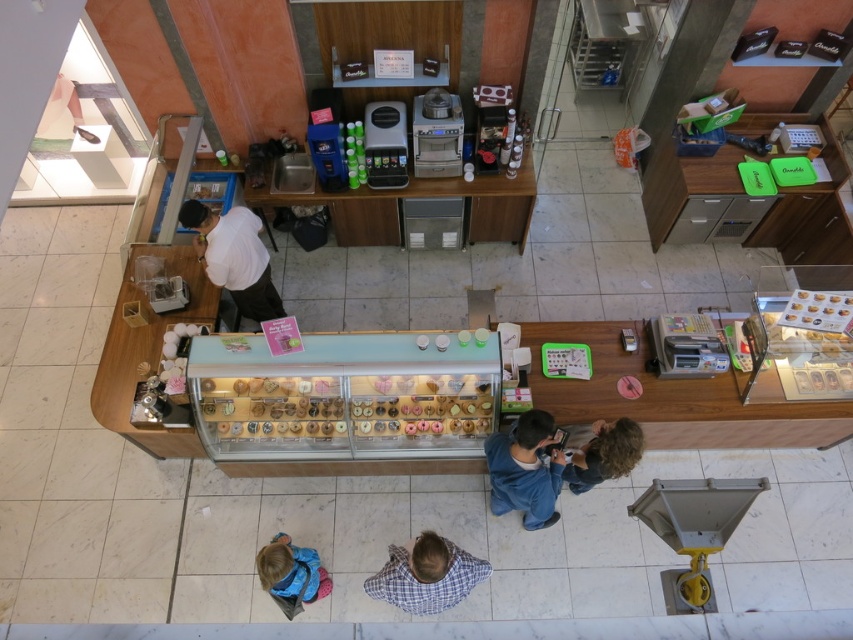
You are a customer entering the bakery and see the blue cotton shirt at lower center and curly hair at lower right. Which of these two items is taller?

The blue cotton shirt at lower center is much taller than curly hair at lower right.